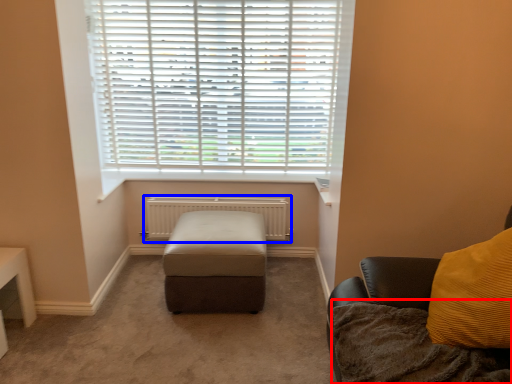
Question: Which object appears closest to the camera in this image, blanket (highlighted by a red box) or radiator (highlighted by a blue box)?

Choices:
 (A) blanket
 (B) radiator

Answer: (A)